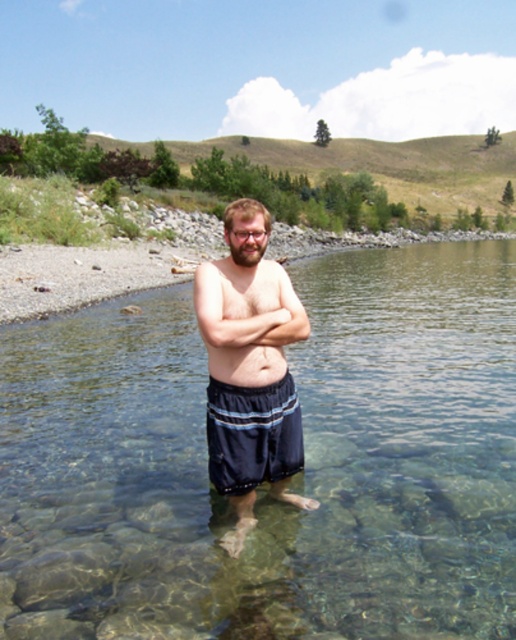
Who is more distant from viewer, (426, 499) or (265, 346)?

The point (426, 499) is more distant.

Does clear glass water at center appear on the left side of dark blue shorts at center?

Correct, you'll find clear glass water at center to the left of dark blue shorts at center.

Which is in front, point (461, 369) or point (237, 312)?

Point (237, 312) is in front.

At what (x,y) coordinates should I click in order to perform the action: click on clear glass water at center. Please return your answer as a coordinate pair (x, y). Looking at the image, I should click on (295, 476).

Which of these two, dark blue fabric shorts at center or smooth skin arm at center, stands taller?

Standing taller between the two is dark blue fabric shorts at center.

Is dark blue fabric shorts at center taller than smooth skin arm at center?

Yes, dark blue fabric shorts at center is taller than smooth skin arm at center.

What do you see at coordinates (252, 435) in the screenshot?
I see `dark blue fabric shorts at center` at bounding box center [252, 435].

The width and height of the screenshot is (516, 640). I want to click on dark blue fabric shorts at center, so click(252, 435).

Is smooth skin arm at center wider than smooth skin belly at center?

Correct, the width of smooth skin arm at center exceeds that of smooth skin belly at center.

Which is in front, point (225, 344) or point (271, 356)?

Point (225, 344) is more forward.

Is point (209, 308) farther from camera compared to point (232, 353)?

No, it is not.

This screenshot has height=640, width=516. I want to click on smooth skin arm at center, so click(x=241, y=301).